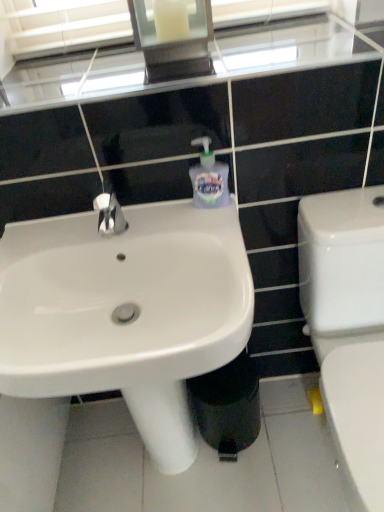
You are a GUI agent. You are given a task and a screenshot of the screen. Output one action in this format:
    pyautogui.click(x=<x>, y=<y>)
    Task: Click on the free spot in front of translucent plastic soap dispenser at center
    This screenshot has width=384, height=512.
    Given the screenshot: What is the action you would take?
    pyautogui.click(x=212, y=228)